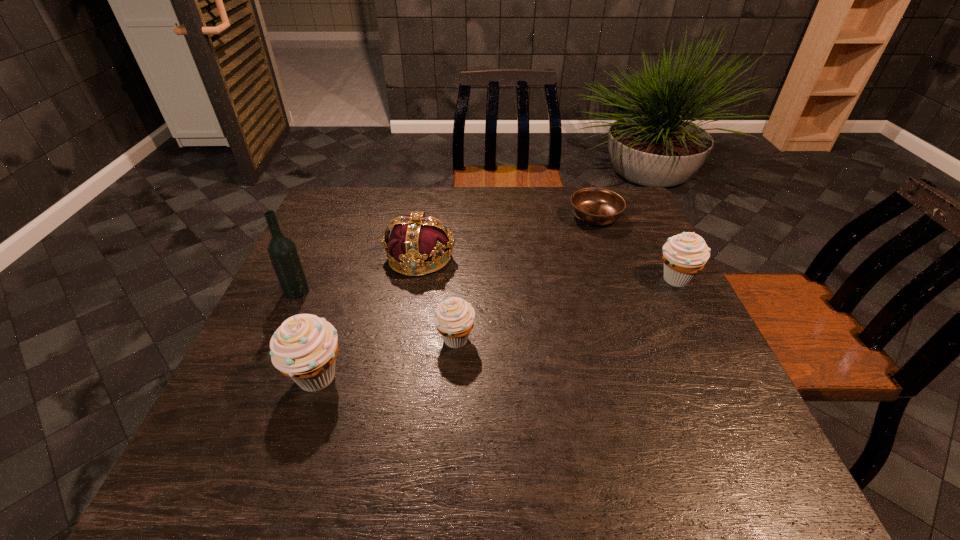
Identify the location of muffin that is the nearest to the farthest muffin. The image size is (960, 540). (454, 318).

Locate an element on the screen. free space that satisfies the following two spatial constraints: 1. on the back side of the farthest object; 2. on the left side of the leftmost object is located at coordinates (331, 217).